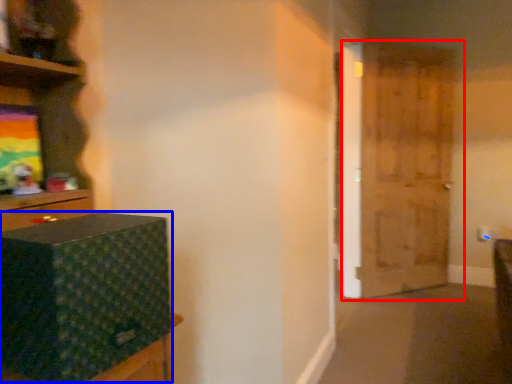
Question: Which object is closer to the camera taking this photo, door (highlighted by a red box) or box (highlighted by a blue box)?

Choices:
 (A) door
 (B) box

Answer: (B)